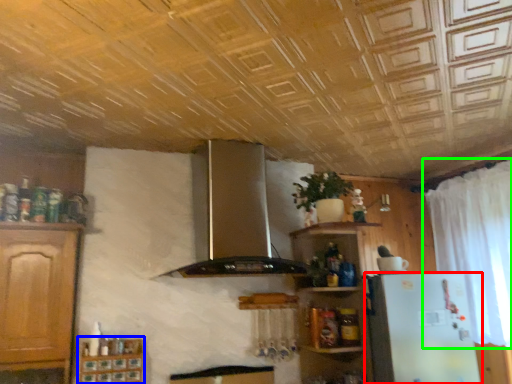
Question: Estimate the real-world distances between objects in this image. Which object is closer to refrigerator (highlighted by a red box), cabinetry (highlighted by a blue box) or curtain (highlighted by a green box)?

Choices:
 (A) cabinetry
 (B) curtain

Answer: (B)